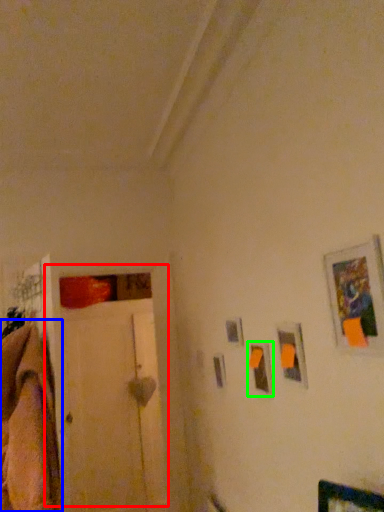
Question: Considering the real-world distances, which object is farthest from door (highlighted by a red box)? blanket (highlighted by a blue box) or picture frame (highlighted by a green box)?

Choices:
 (A) blanket
 (B) picture frame

Answer: (B)